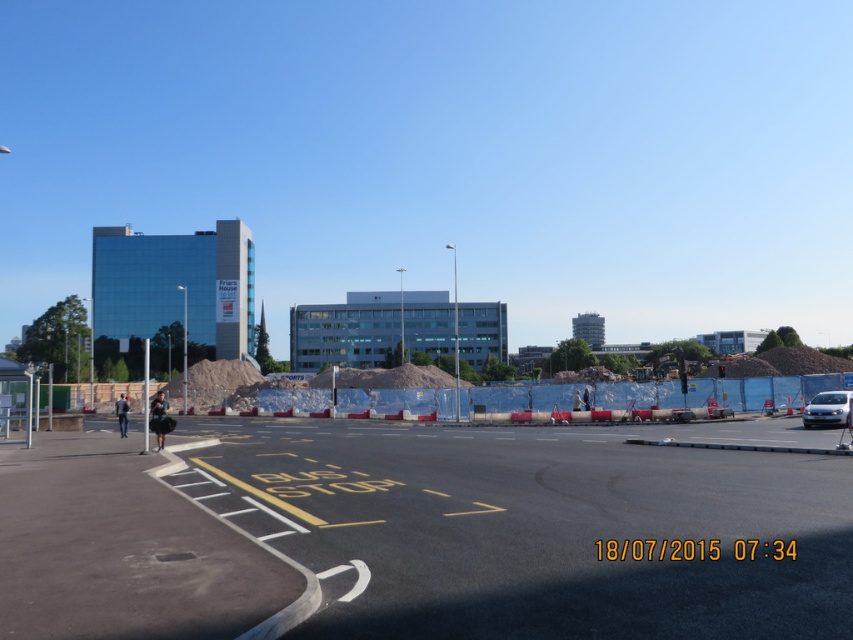
Based on the photo, who is more distant from viewer, [334,428] or [691,394]?

Positioned behind is point [691,394].

Between black asphalt at center and blue plastic barrier at center, which one has more height?

Standing taller between the two is blue plastic barrier at center.

Describe the element at coordinates (535, 531) in the screenshot. I see `black asphalt at center` at that location.

Identify the location of black asphalt at center. The width and height of the screenshot is (853, 640). (535, 531).

Is black asphalt at center positioned at the back of satin silver car at right?

That is False.

Is black asphalt at center to the right of satin silver car at right from the viewer's perspective?

Incorrect, black asphalt at center is not on the right side of satin silver car at right.

Does point (686, 488) come in front of point (840, 390)?

Yes.

In order to click on black asphalt at center in this screenshot , I will do `click(535, 531)`.

Does blue plastic barrier at center appear under satin silver car at right?

Yes.

Does blue plastic barrier at center have a lesser height compared to satin silver car at right?

No, blue plastic barrier at center is not shorter than satin silver car at right.

At what (x,y) coordinates should I click in order to perform the action: click on blue plastic barrier at center. Please return your answer as a coordinate pair (x, y). Looking at the image, I should click on (764, 390).